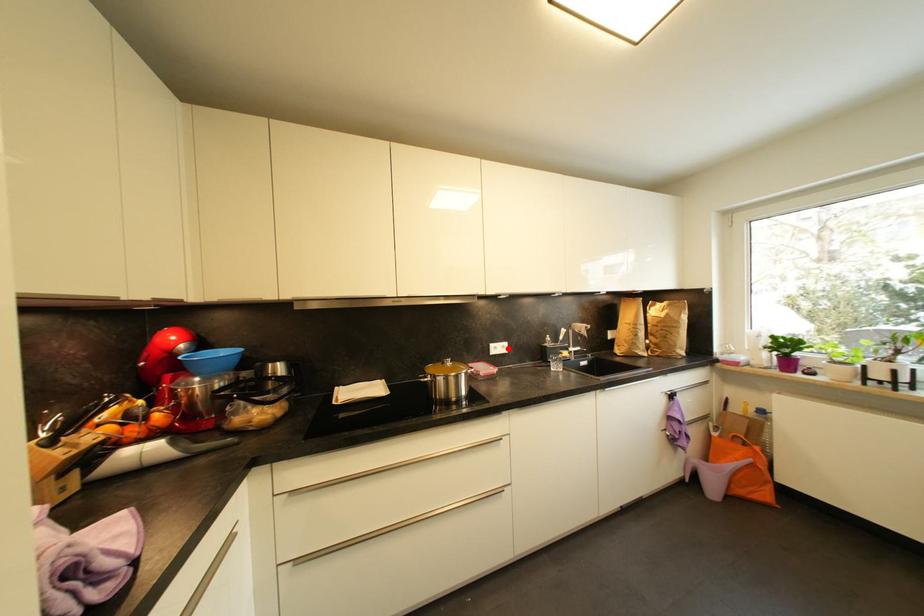
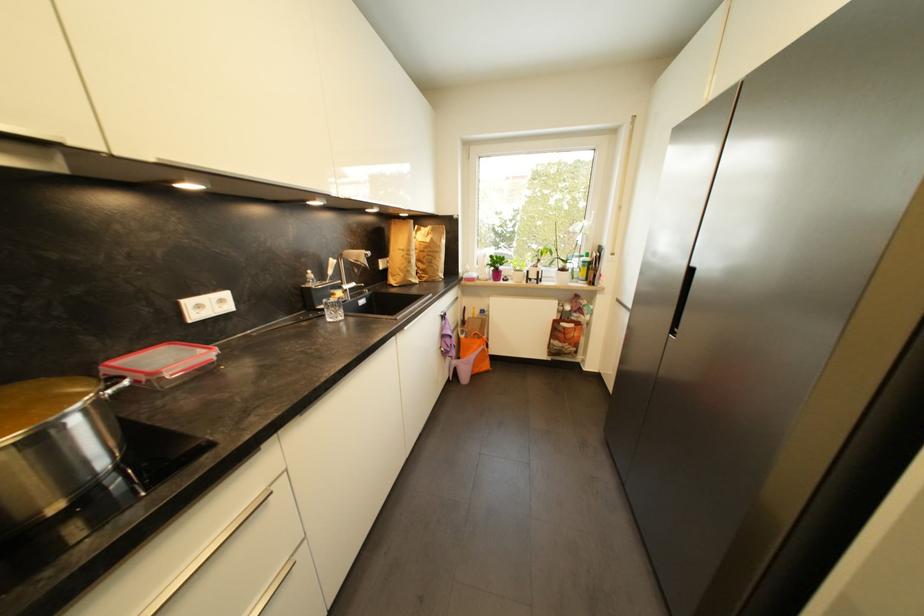
The point at the highlighted location is marked in the first image. Where is the corresponding point in the second image?

(226, 302)